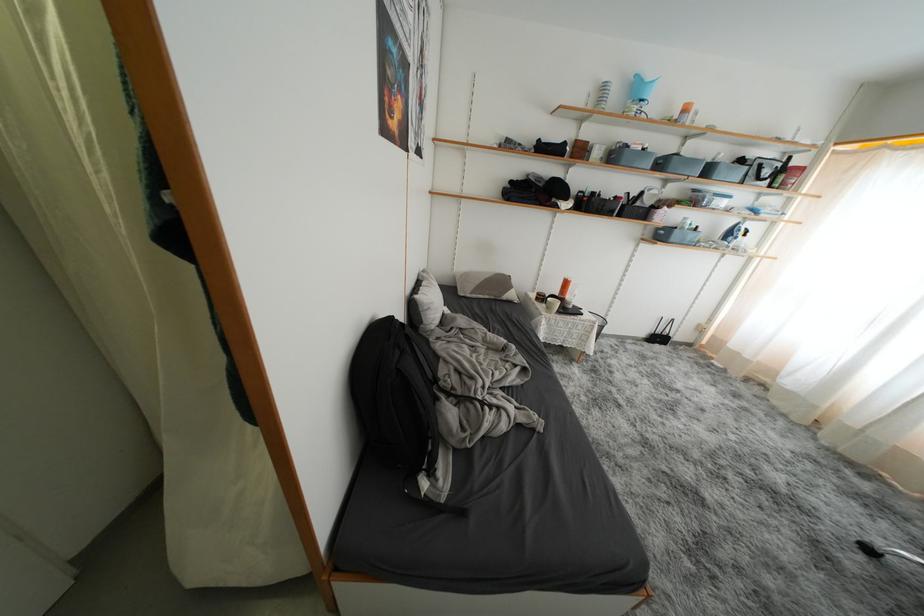
Which object does [394,395] point to?

It refers to a black backpack.